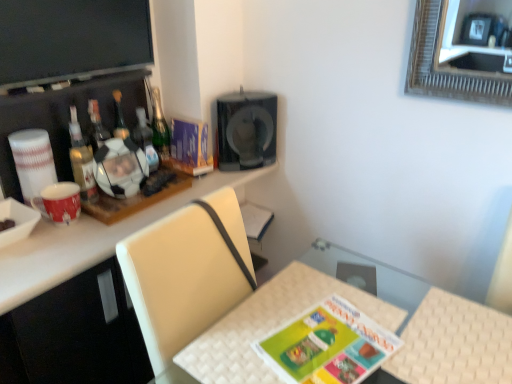
You are a GUI agent. You are given a task and a screenshot of the screen. Output one action in this format:
    pyautogui.click(x=<x>, y=<y>)
    Task: Click on the free space to the back side of matte green board game at center
    The width and height of the screenshot is (512, 384).
    Given the screenshot: What is the action you would take?
    pyautogui.click(x=306, y=292)